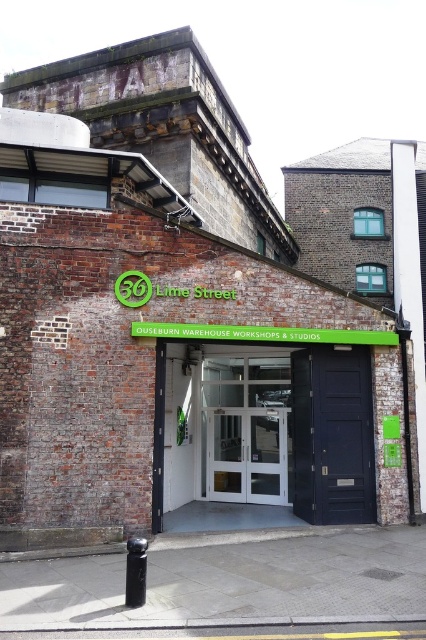
You are a delivery person arriving at 36 Lime Street. You need to enter the building but cannot see the entrance clearly. You see a white glass door at center and a black polished metal pole at lower center. Which object is larger and can help you locate the entrance?

The white glass door at center is bigger than the black polished metal pole at lower center, so the larger white glass door at center is likely the entrance.

You are a delivery person arriving at 36 Lime Street. You need to enter through the entrance but must avoid hitting your head on any objects. The white glass door at center is 2 meters tall, and the black polished metal pole at lower center is 1.5 meters tall. Which object should you be cautious of when entering?

The white glass door at center is located above the black polished metal pole at lower center. Since the door is taller at 2 meters, you should be cautious of hitting your head on the white glass door at center when entering.

You are a delivery person with a cart that is 5 meters wide. You need to move through the entrance of 36 Lime Street. Can you fit your cart between the white glass door at center and the black polished metal pole at lower center?

The white glass door at center and the black polished metal pole at lower center are 6.02 meters apart from each other, so yes, the cart can fit through the space between them since it is wider than the cart.